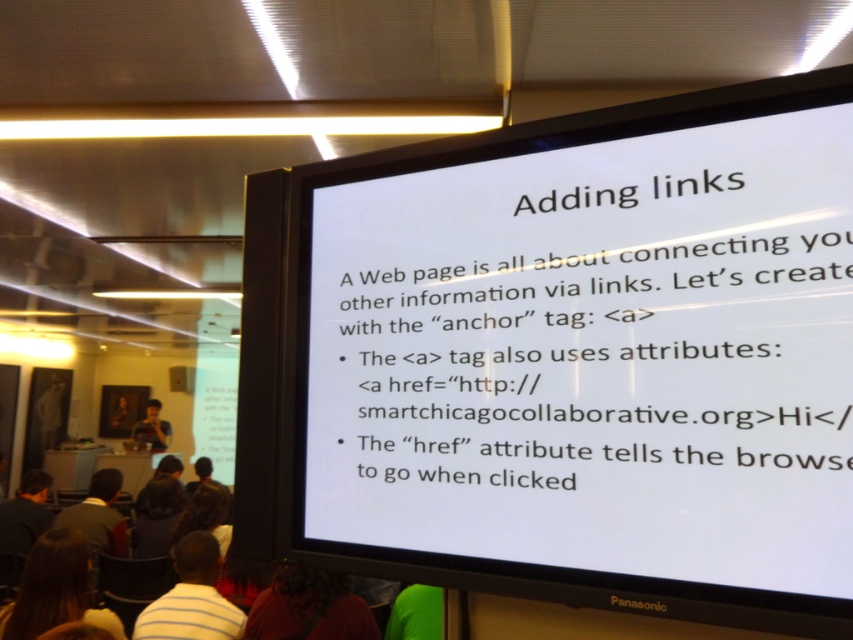
Can you confirm if matte brown shirt at lower center is bigger than white striped shirt at lower left?

No, matte brown shirt at lower center is not bigger than white striped shirt at lower left.

Between matte brown shirt at lower center and white striped shirt at lower left, which one has more height?

white striped shirt at lower left is taller.

Is point (357, 612) farther from viewer compared to point (218, 618)?

That is False.

At what (x,y) coordinates should I click in order to perform the action: click on matte brown shirt at lower center. Please return your answer as a coordinate pair (x, y). This screenshot has height=640, width=853. Looking at the image, I should click on (309, 608).

Does white striped shirt at lower left have a lesser height compared to matte black camera at lower left?

Indeed, white striped shirt at lower left has a lesser height compared to matte black camera at lower left.

Who is positioned more to the left, white striped shirt at lower left or matte black camera at lower left?

From the viewer's perspective, matte black camera at lower left appears more on the left side.

You are a GUI agent. You are given a task and a screenshot of the screen. Output one action in this format:
    pyautogui.click(x=<x>, y=<y>)
    Task: Click on the white striped shirt at lower left
    This screenshot has width=853, height=640.
    Given the screenshot: What is the action you would take?
    pyautogui.click(x=192, y=596)

Identify the location of white striped shirt at lower left. pos(192,596).

Is point (788, 376) closer to viewer compared to point (132, 435)?

Yes.

Looking at this image, does white paper at upper center have a larger size compared to matte black camera at lower left?

Indeed, white paper at upper center has a larger size compared to matte black camera at lower left.

Which is in front, point (558, 394) or point (140, 435)?

Positioned in front is point (558, 394).

This screenshot has width=853, height=640. What are the coordinates of `white paper at upper center` in the screenshot? It's located at (587, 328).